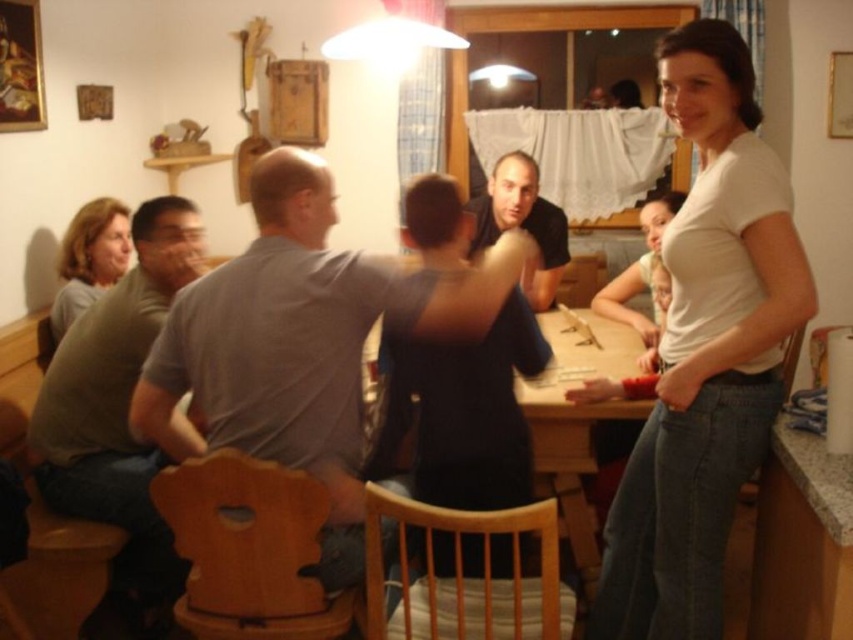
Question: Which object appears farthest from the camera in this image?

Choices:
 (A) white matte shirt at right
 (B) gray matte shirt at center

Answer: (B)

Question: Considering the real-world distances, which object is farthest from the white matte shirt at right?

Choices:
 (A) matte gray shirt at left
 (B) black matte shirt at center
 (C) gray cotton shirt at left

Answer: (A)

Question: Can you confirm if gray matte shirt at center is smaller than matte gray shirt at left?

Choices:
 (A) yes
 (B) no

Answer: (B)

Question: Can you confirm if white matte shirt at right is smaller than gray cotton shirt at left?

Choices:
 (A) yes
 (B) no

Answer: (B)

Question: Is white matte shirt at right below wooden at center?

Choices:
 (A) no
 (B) yes

Answer: (A)

Question: Which of the following is the farthest from the observer?

Choices:
 (A) (526, 211)
 (B) (149, 497)

Answer: (A)